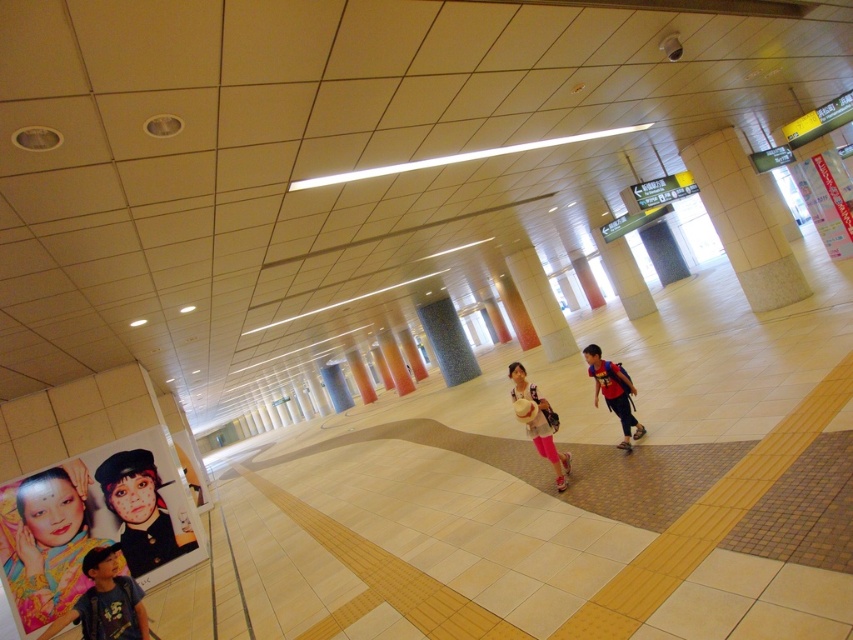
Question: Can you confirm if matte black hat at lower left is smaller than dark blue t-shirt at lower left?

Choices:
 (A) no
 (B) yes

Answer: (A)

Question: Which object is the closest to the colorful paper poster at lower left?

Choices:
 (A) dark blue t-shirt at lower left
 (B) matte red backpack at center
 (C) multicolored fabric at lower left
 (D) matte pink pants at center

Answer: (C)

Question: Can you confirm if matte red backpack at center is positioned below matte pink pants at center?

Choices:
 (A) yes
 (B) no

Answer: (B)

Question: Where is colorful paper poster at lower left located in relation to matte pink pants at center in the image?

Choices:
 (A) below
 (B) above

Answer: (A)

Question: Considering the real-world distances, which object is closest to the dark blue t-shirt at lower left?

Choices:
 (A) multicolored fabric at lower left
 (B) matte pink pants at center
 (C) matte red backpack at center

Answer: (B)

Question: Which of the following is the farthest from the observer?

Choices:
 (A) (612, 388)
 (B) (109, 508)

Answer: (B)